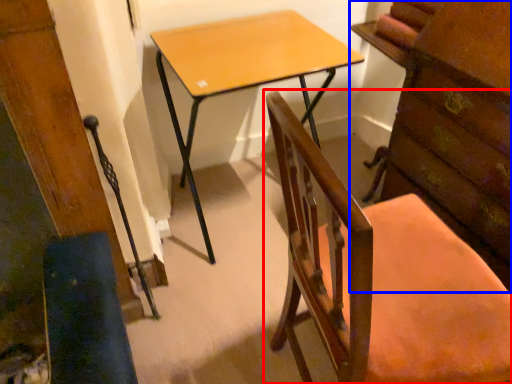
Question: Among these objects, which one is nearest to the camera, chair (highlighted by a red box) or chest of drawers (highlighted by a blue box)?

Choices:
 (A) chair
 (B) chest of drawers

Answer: (A)